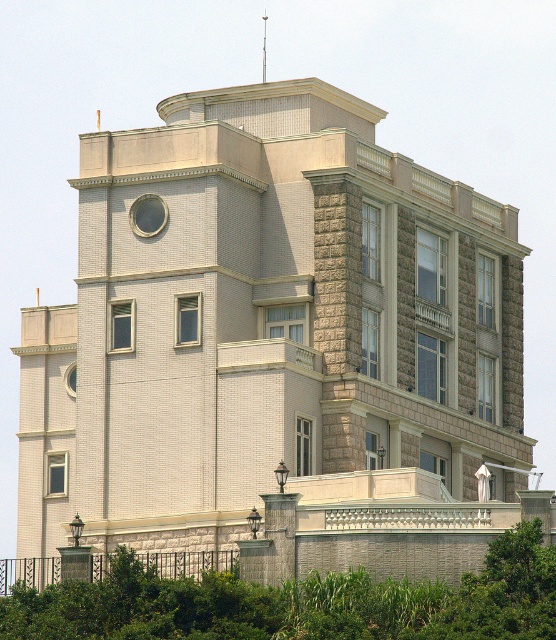
Is green leafy tree at lower center below metallic spire at upper center?

Yes.

Does green leafy tree at lower center come in front of metallic spire at upper center?

Yes, it is.

The width and height of the screenshot is (556, 640). What do you see at coordinates (299, 604) in the screenshot? I see `green leafy tree at lower center` at bounding box center [299, 604].

At what (x,y) coordinates should I click in order to perform the action: click on green leafy tree at lower center. Please return your answer as a coordinate pair (x, y). Looking at the image, I should click on (299, 604).